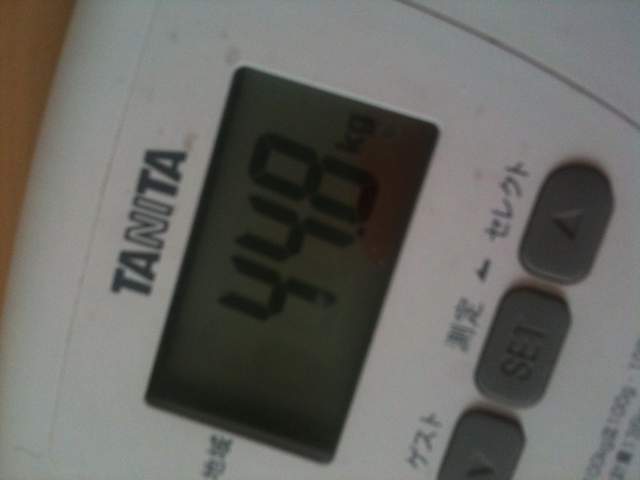
At what (x,y) coordinates should I click in order to perform the action: click on pale beige wooden table/counter where scale is sat upon. Please return your answer as a coordinate pair (x, y). The height and width of the screenshot is (480, 640). Looking at the image, I should click on (13, 31).